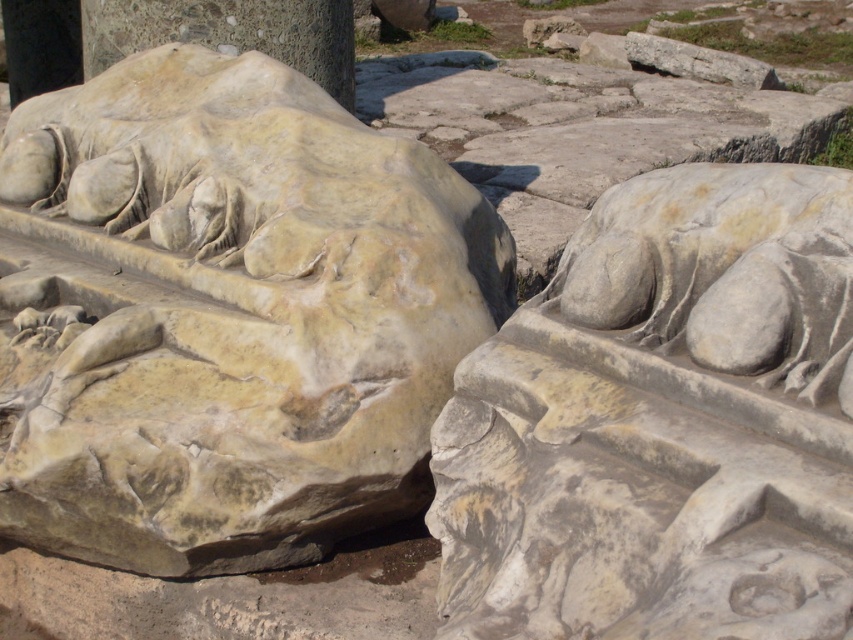
Question: Which point is farther to the camera?

Choices:
 (A) (836, 552)
 (B) (4, 284)

Answer: (B)

Question: Which object is the closest to the matte stone sculpture at center?

Choices:
 (A) smooth gray stone at center
 (B) gray stone sculpture at center

Answer: (B)

Question: Is matte stone sculpture at center above gray stone sculpture at center?

Choices:
 (A) no
 (B) yes

Answer: (B)

Question: Which object is farther from the camera taking this photo?

Choices:
 (A) matte stone sculpture at center
 (B) smooth gray stone at center
 (C) gray stone sculpture at center

Answer: (B)

Question: Does matte stone sculpture at center lie behind smooth gray stone at center?

Choices:
 (A) no
 (B) yes

Answer: (A)

Question: Is the position of matte stone sculpture at center less distant than that of smooth gray stone at center?

Choices:
 (A) yes
 (B) no

Answer: (A)